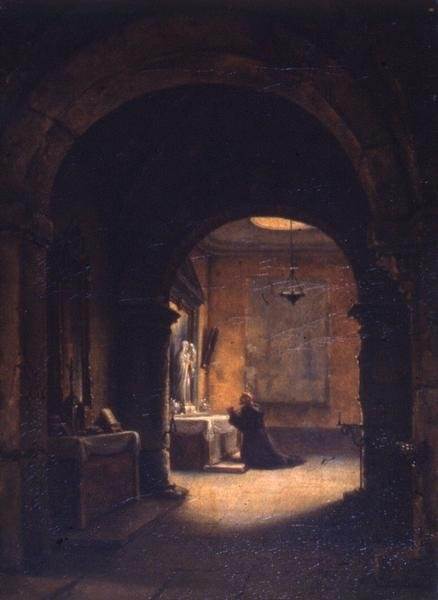
At what (x,y) coordinates should I click in order to perform the action: click on statue. Please return your answer as a coordinate pair (x, y). The height and width of the screenshot is (600, 438). Looking at the image, I should click on [x=179, y=371].